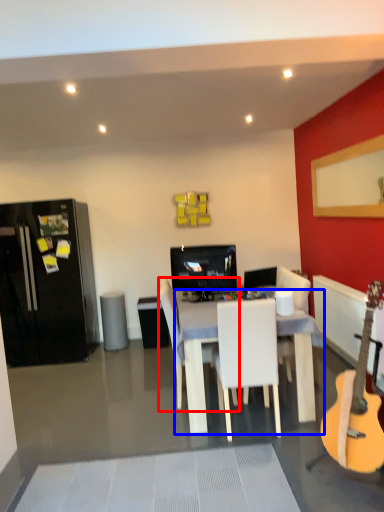
Question: Among these objects, which one is nearest to the camera, chair (highlighted by a red box) or desk (highlighted by a blue box)?

Choices:
 (A) chair
 (B) desk

Answer: (B)